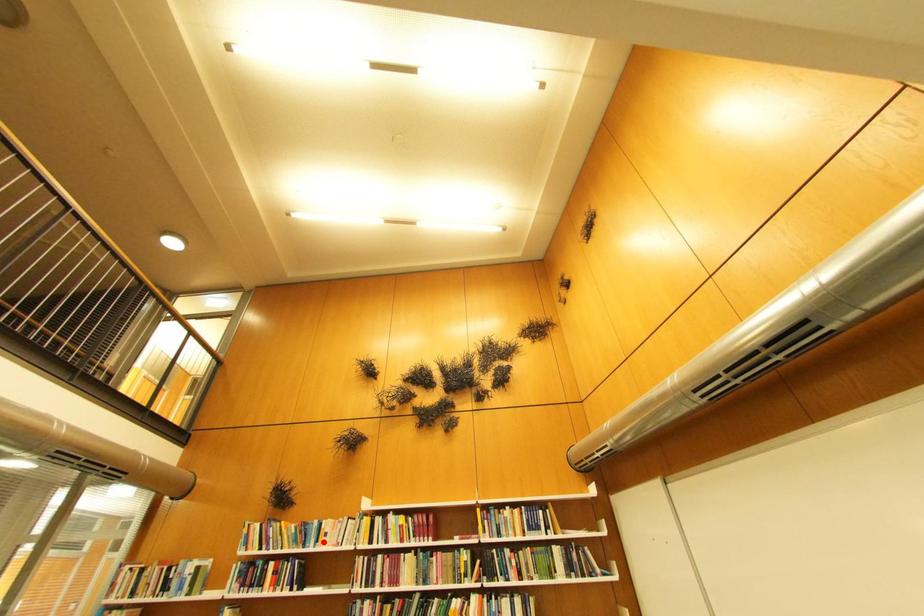
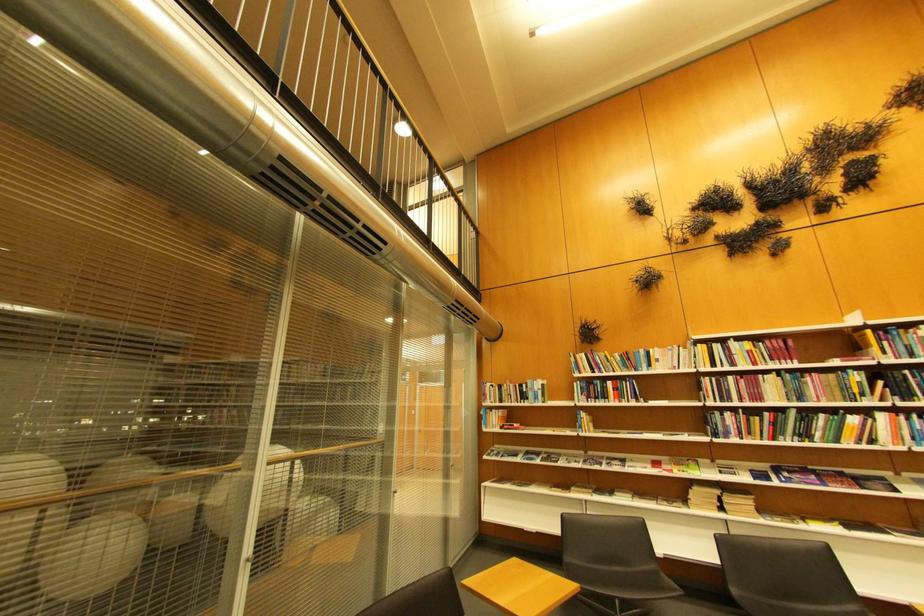
Question: I am providing you with two images of the same scene from different viewpoints. A red point is marked on the first image. Is the red point's position out of view in image 2?

Choices:
 (A) Yes
 (B) No

Answer: (B)